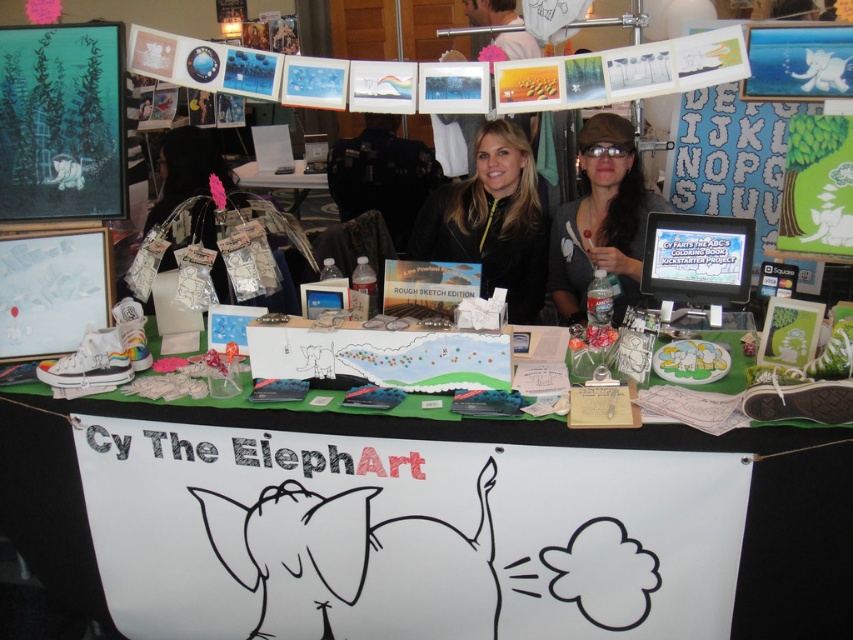
You are an artist who wants to hang a new 1.5 feet wide painting between the white paper banner at center and the matte white paper at center. Is there enough space between them to fit your painting?

The white paper banner at center is 4.16 feet from matte white paper at center. Since the distance between them is greater than the painting width of 1.5 feet, the painting can be placed between them.

You are an art collector who wants to purchase both the teal matte painting at upper left and the matte black jacket at center. However, your suitcase can only hold items that are no larger than the size of the jacket. Can you safely pack both items into your suitcase?

The teal matte painting at upper left is smaller than the matte black jacket at center, so it will fit inside the suitcase. However, since the suitcase can only hold items up to the size of the jacket, you can only pack one of them at a time unless they can be folded or compressed. Since the jacket is larger, you can only take either the painting or the jacket, not both together.

You are a customer at the Cy The ElephArt stall and want to buy both the matte black jacket at center and the matte black cap at center. You need to place them on a shelf that can only hold items up to the height of the cap. Can you stack them without exceeding the shelf height limit?

The matte black jacket at center is taller than the matte black cap at center. If you stack them, the total height would exceed the shelf limit, so you cannot stack them without exceeding the shelf height limit.